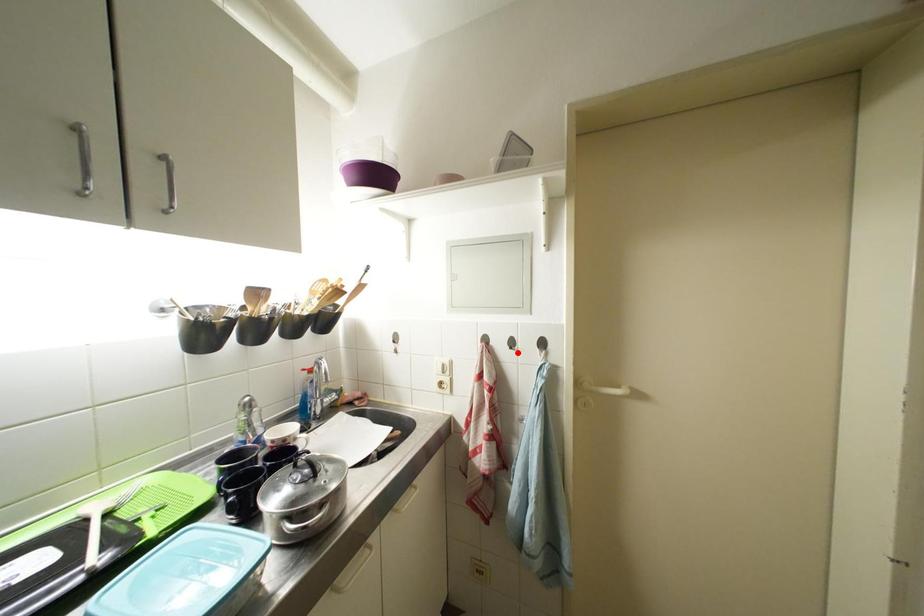
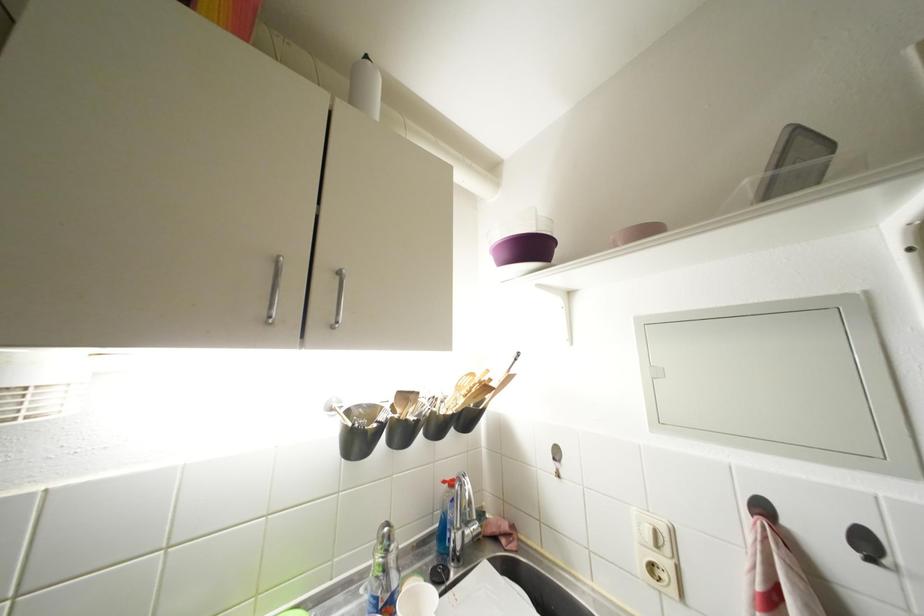
Where in the second image is the point corresponding to the highlighted location from the first image?

(877, 565)